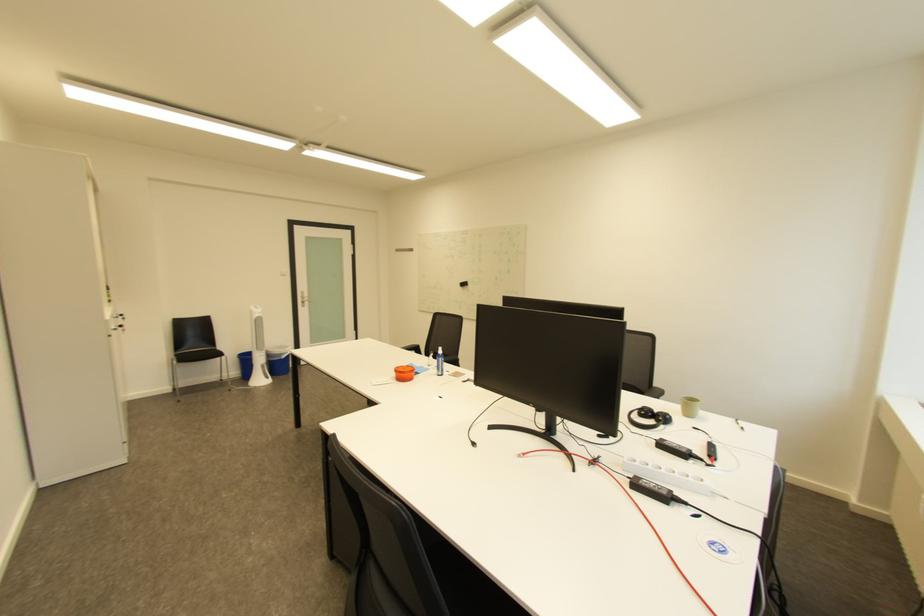
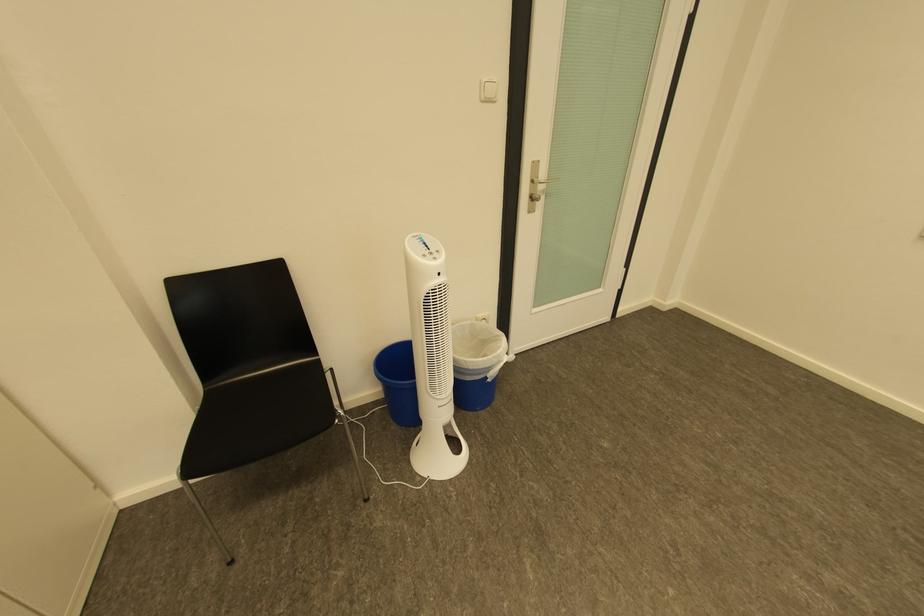
Find the pixel in the second image that matches point (265, 310) in the first image.

(439, 262)